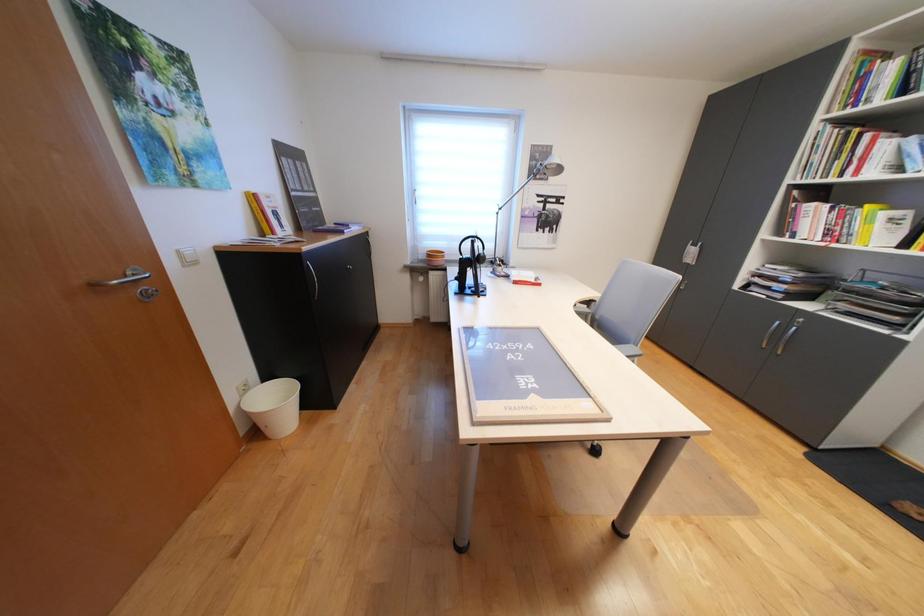
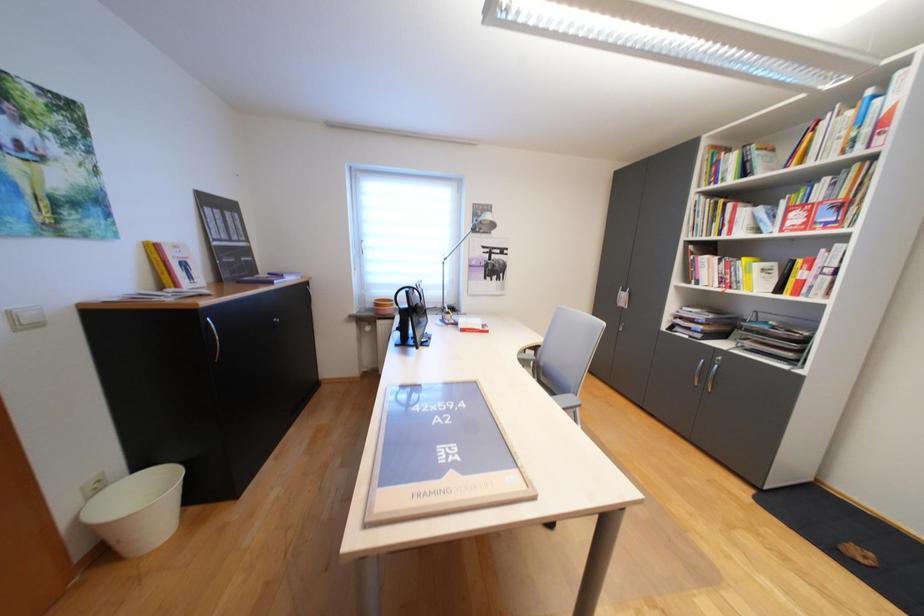
Question: In a continuous first-person perspective shot, in which direction is the camera moving?

Choices:
 (A) Left
 (B) Right
 (C) Forward
 (D) Backward

Answer: (B)